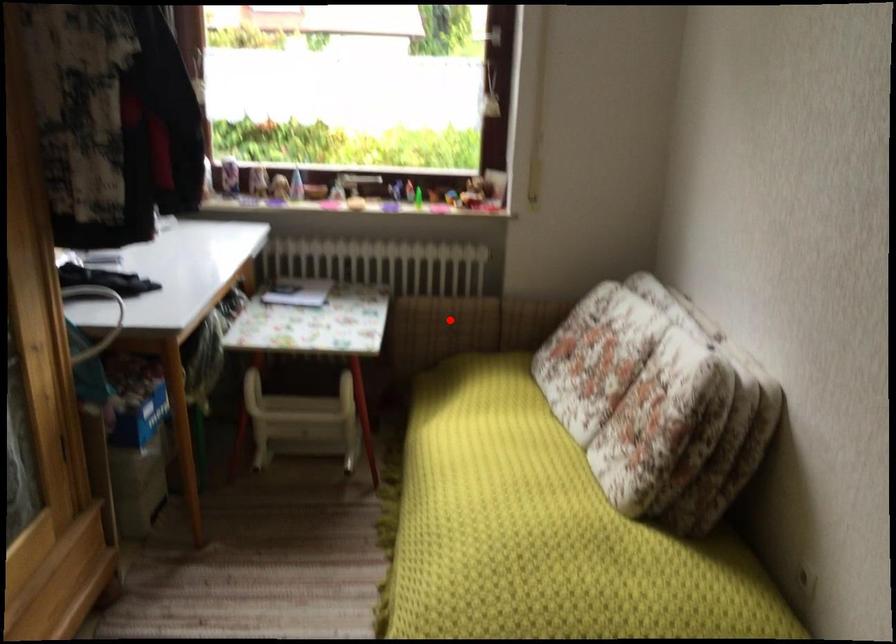
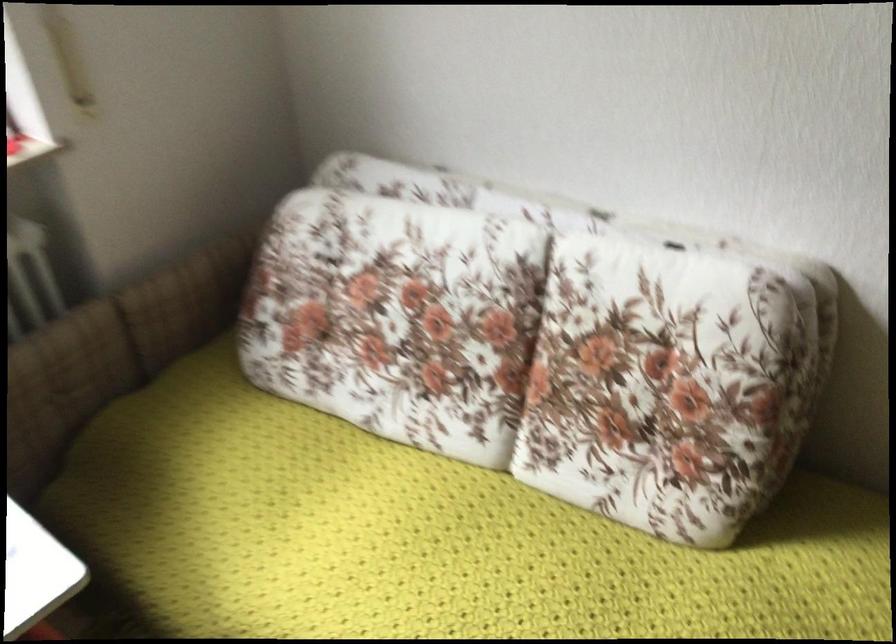
In the second image, find the point that corresponds to the highlighted location in the first image.

(63, 384)